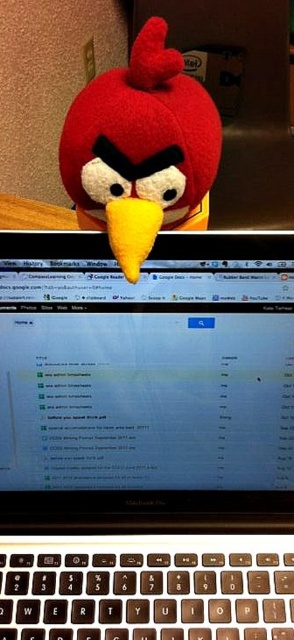
Does black plastic laptop at upper center have a lesser width compared to matte plush bird at center?

No, black plastic laptop at upper center is not thinner than matte plush bird at center.

Which is below, black plastic laptop at upper center or matte plush bird at center?

black plastic laptop at upper center

Does point (283, 556) come behind point (151, 48)?

Yes, it is.

The width and height of the screenshot is (294, 640). Find the location of `black plastic laptop at upper center`. black plastic laptop at upper center is located at coordinates (147, 440).